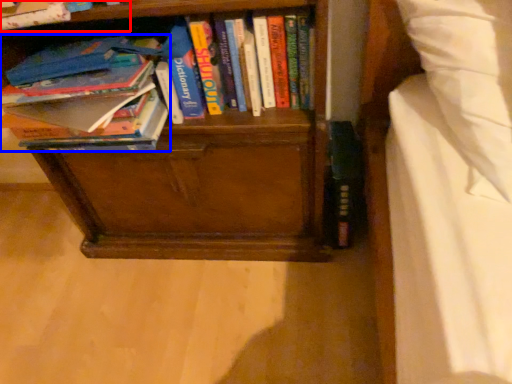
Question: Which object is further to the camera taking this photo, book (highlighted by a red box) or book (highlighted by a blue box)?

Choices:
 (A) book
 (B) book

Answer: (B)